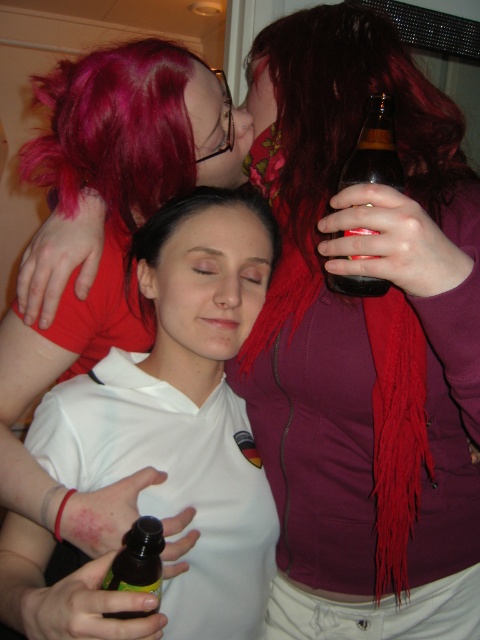
Does matte white shirt at center appear on the right side of brown glass bottle at upper right?

In fact, matte white shirt at center is to the left of brown glass bottle at upper right.

Does matte white shirt at center have a larger size compared to brown glass bottle at upper right?

Yes.

The height and width of the screenshot is (640, 480). In order to click on matte white shirt at center in this screenshot , I will do pyautogui.click(x=188, y=218).

How distant is matte white shirt at center from translucent plastic bottle at center?

They are 46.28 centimeters apart.

From the picture: Does matte white shirt at center appear on the left side of translucent plastic bottle at center?

Indeed, matte white shirt at center is positioned on the left side of translucent plastic bottle at center.

Identify the location of matte white shirt at center. Image resolution: width=480 pixels, height=640 pixels. (188, 218).

Is white matte shirt at center to the right of brown glass bottle at upper right from the viewer's perspective?

No, white matte shirt at center is not to the right of brown glass bottle at upper right.

In the scene shown: Does white matte shirt at center have a lesser width compared to brown glass bottle at upper right?

Incorrect, white matte shirt at center's width is not less than brown glass bottle at upper right's.

Who is more distant from viewer, (x=34, y=632) or (x=368, y=256)?

Positioned behind is point (x=368, y=256).

Image resolution: width=480 pixels, height=640 pixels. I want to click on white matte shirt at center, so click(184, 406).